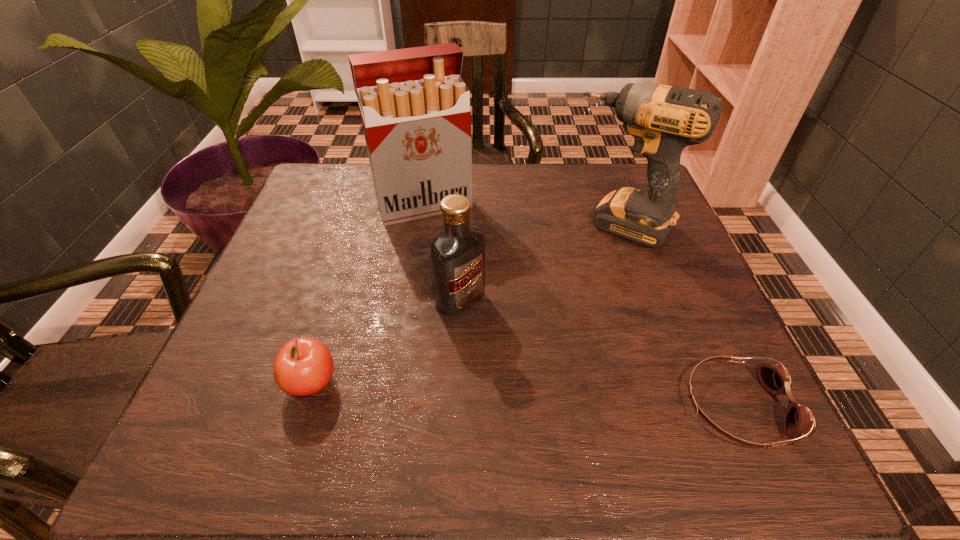
In order to click on object that is positioned at the left edge in this screenshot , I will do `click(303, 366)`.

At what (x,y) coordinates should I click in order to perform the action: click on goggles that is at the right edge. Please return your answer as a coordinate pair (x, y). Looking at the image, I should click on coord(799,420).

Locate an element on the screen. This screenshot has height=540, width=960. drill that is at the right edge is located at coordinates (663, 120).

Find the location of `object at the near left corner`. object at the near left corner is located at coordinates (303, 366).

At what (x,y) coordinates should I click in order to perform the action: click on object present at the far right corner. Please return your answer as a coordinate pair (x, y). This screenshot has height=540, width=960. Looking at the image, I should click on (663, 120).

Where is `object positioned at the near right corner`? object positioned at the near right corner is located at coordinates (799, 420).

The height and width of the screenshot is (540, 960). What are the coordinates of `blank space at the far edge of the desktop` in the screenshot? It's located at (523, 170).

I want to click on vacant space at the near edge of the desktop, so click(x=408, y=378).

This screenshot has height=540, width=960. Find the location of `vacant space at the left edge of the desktop`. vacant space at the left edge of the desktop is located at coordinates (308, 218).

Where is `vacant space at the right edge of the desktop`? vacant space at the right edge of the desktop is located at coordinates (711, 304).